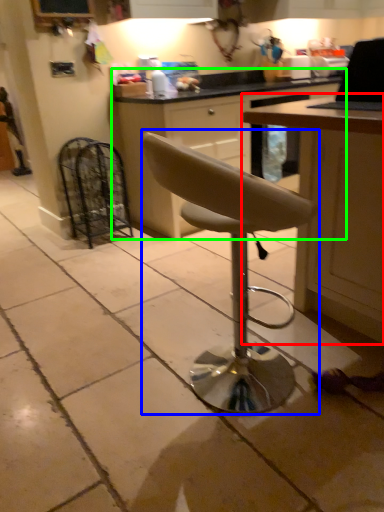
Question: Considering the real-world distances, which object is closest to table (highlighted by a red box)? chair (highlighted by a blue box) or cabinetry (highlighted by a green box).

Choices:
 (A) chair
 (B) cabinetry

Answer: (A)